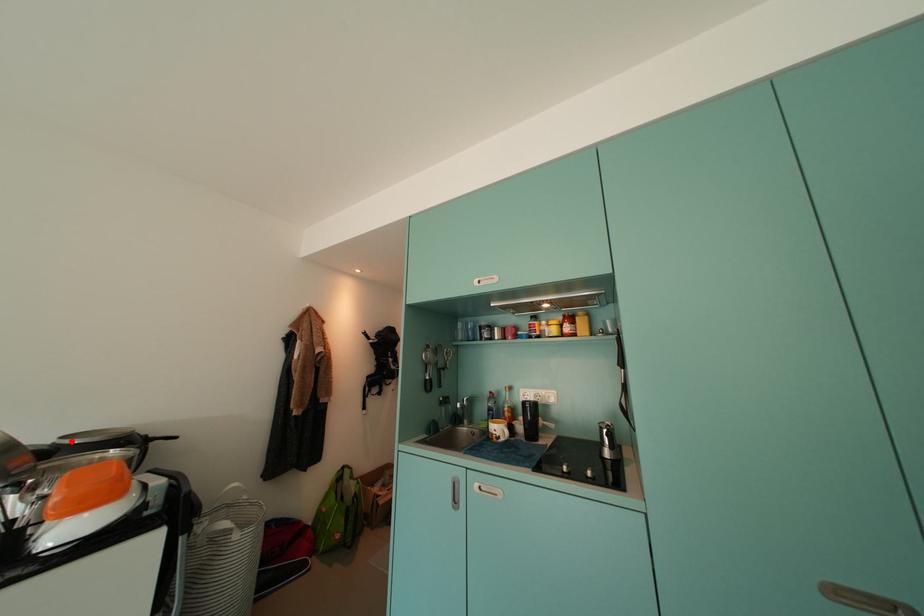
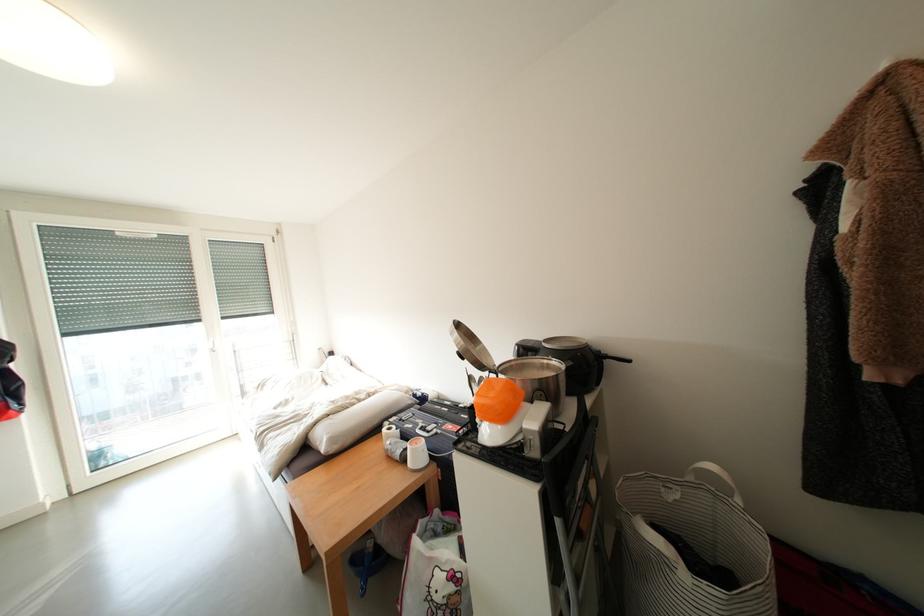
Question: I am providing you with two images of the same scene from different viewpoints. A red point is marked on the first image. Can you still see the location of the red point in image 2?

Choices:
 (A) Yes
 (B) No

Answer: (A)